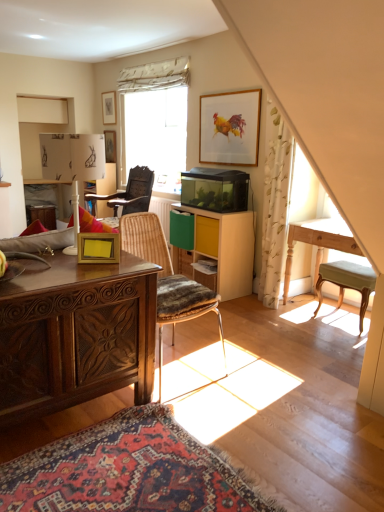
This screenshot has width=384, height=512. I want to click on free space in front of rustic wood chair at center, the 2th chair viewed from the left, so click(220, 415).